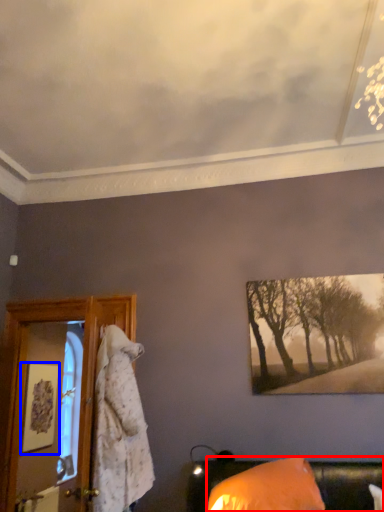
Question: Which object is further to the camera taking this photo, furniture (highlighted by a red box) or picture frame (highlighted by a blue box)?

Choices:
 (A) furniture
 (B) picture frame

Answer: (B)